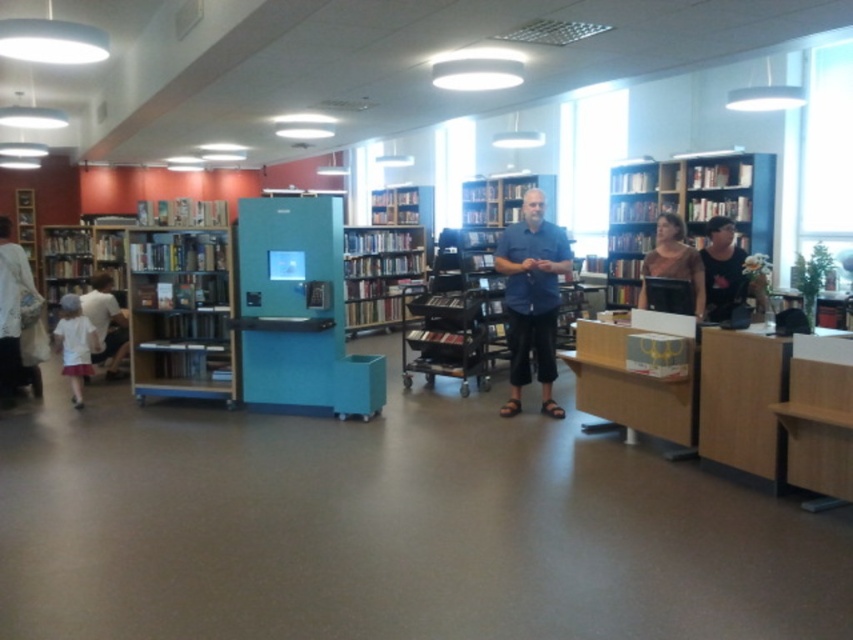
Does matte pink shirt at center lie in front of white fabric dress at lower left?

Yes, matte pink shirt at center is in front of white fabric dress at lower left.

This screenshot has width=853, height=640. Find the location of `matte pink shirt at center`. matte pink shirt at center is located at coordinates (672, 260).

I want to click on matte pink shirt at center, so click(672, 260).

Between black tank top at right and white cotton shirt at left, which one is positioned lower?

white cotton shirt at left is below.

The image size is (853, 640). What are the coordinates of `black tank top at right` in the screenshot? It's located at (726, 273).

Who is taller, blue cotton shirt at center or wooden bookshelf at center?

blue cotton shirt at center

This screenshot has height=640, width=853. What do you see at coordinates (532, 298) in the screenshot?
I see `blue cotton shirt at center` at bounding box center [532, 298].

Based on the photo, measure the distance between point (x=549, y=336) and camera.

Point (x=549, y=336) is 5.69 meters from camera.

Where is `blue cotton shirt at center`? The width and height of the screenshot is (853, 640). blue cotton shirt at center is located at coordinates (532, 298).